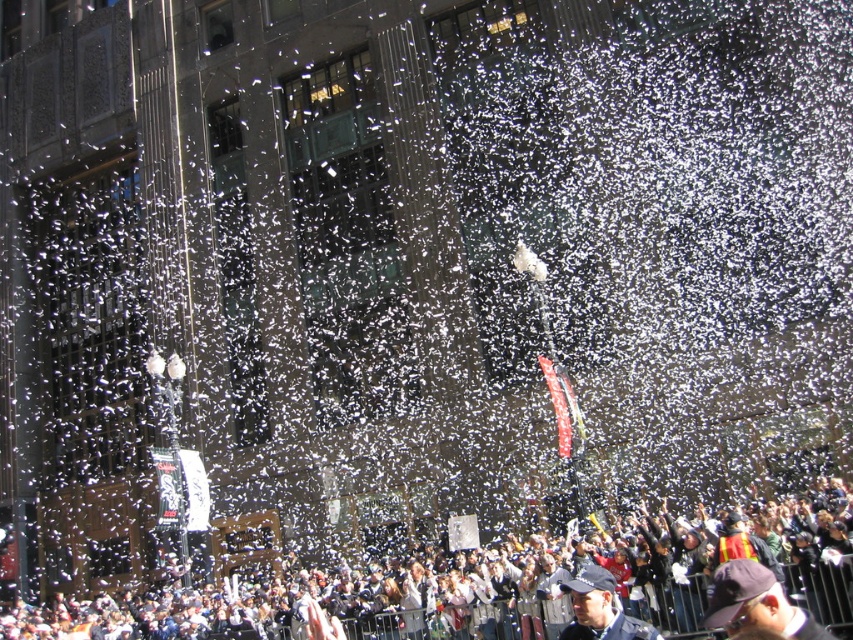
Question: Which point appears farthest from the camera in this image?

Choices:
 (A) (x=755, y=618)
 (B) (x=596, y=634)

Answer: (B)

Question: Is white paper confetti at lower center behind dark blue fabric cap at lower right?

Choices:
 (A) no
 (B) yes

Answer: (A)

Question: Is dark blue fabric cap at lower right closer to camera compared to blue fabric cap at lower center?

Choices:
 (A) yes
 (B) no

Answer: (A)

Question: Does white paper confetti at lower center have a greater width compared to dark blue fabric cap at lower right?

Choices:
 (A) yes
 (B) no

Answer: (A)

Question: Estimate the real-world distances between objects in this image. Which object is closer to the white paper confetti at lower center?

Choices:
 (A) blue fabric cap at lower center
 (B) dark blue fabric cap at lower right

Answer: (A)

Question: Based on their relative distances, which object is farther from the dark blue fabric cap at lower right?

Choices:
 (A) blue fabric cap at lower center
 (B) white paper confetti at lower center

Answer: (B)